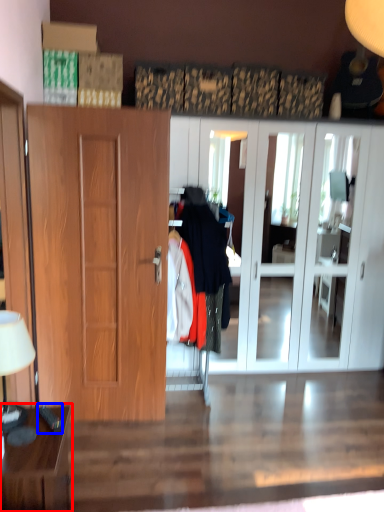
Question: Which object appears closest to the camera in this image, table (highlighted by a red box) or remote control (highlighted by a blue box)?

Choices:
 (A) table
 (B) remote control

Answer: (A)